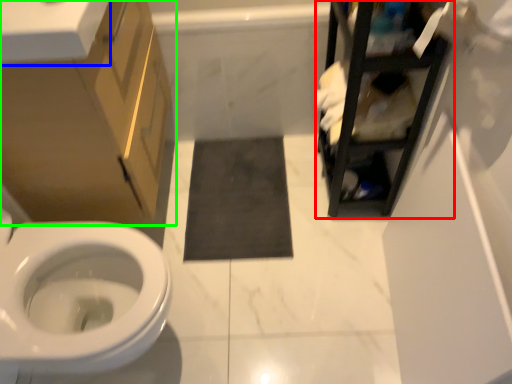
Question: Estimate the real-world distances between objects in this image. Which object is closer to cabinetry (highlighted by a red box), counter top (highlighted by a blue box) or bathroom cabinet (highlighted by a green box)?

Choices:
 (A) counter top
 (B) bathroom cabinet

Answer: (B)